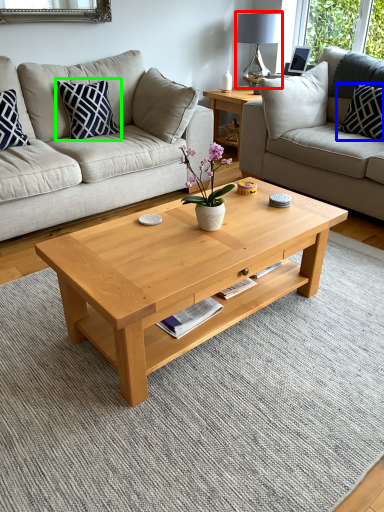
Question: Which object is positioned closest to lamp (highlighted by a red box)? Select from pillow (highlighted by a blue box) and pillow (highlighted by a green box).

Choices:
 (A) pillow
 (B) pillow

Answer: (A)